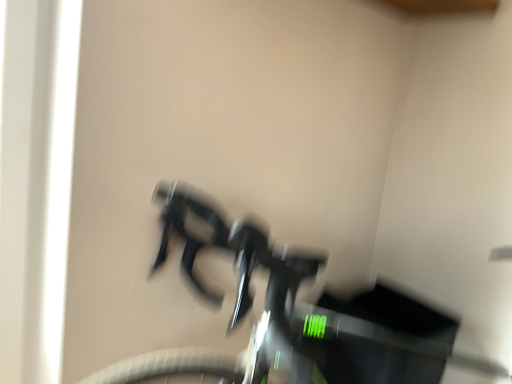
What is the approximate width of black matte bicycle handlebars at center?

1.37 meters.

The width and height of the screenshot is (512, 384). What do you see at coordinates (296, 318) in the screenshot?
I see `black matte bicycle handlebars at center` at bounding box center [296, 318].

At what (x,y) coordinates should I click in order to perform the action: click on black matte bicycle handlebars at center. Please return your answer as a coordinate pair (x, y). Looking at the image, I should click on (296, 318).

What is the approximate height of black matte bicycle handlebars at center?

It is 28.57 inches.

Where is `black matte bicycle handlebars at center`? The width and height of the screenshot is (512, 384). black matte bicycle handlebars at center is located at coordinates (296, 318).